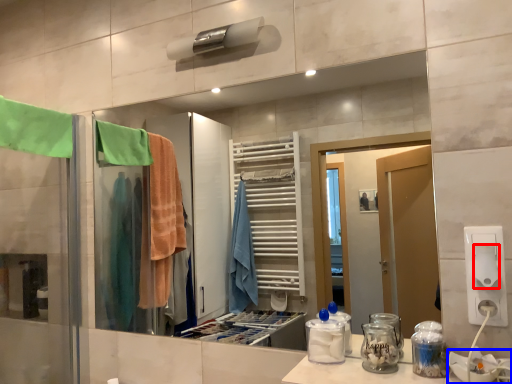
Question: Among these objects, which one is nearest to the camera, toilet paper (highlighted by a red box) or sink (highlighted by a blue box)?

Choices:
 (A) toilet paper
 (B) sink

Answer: (B)